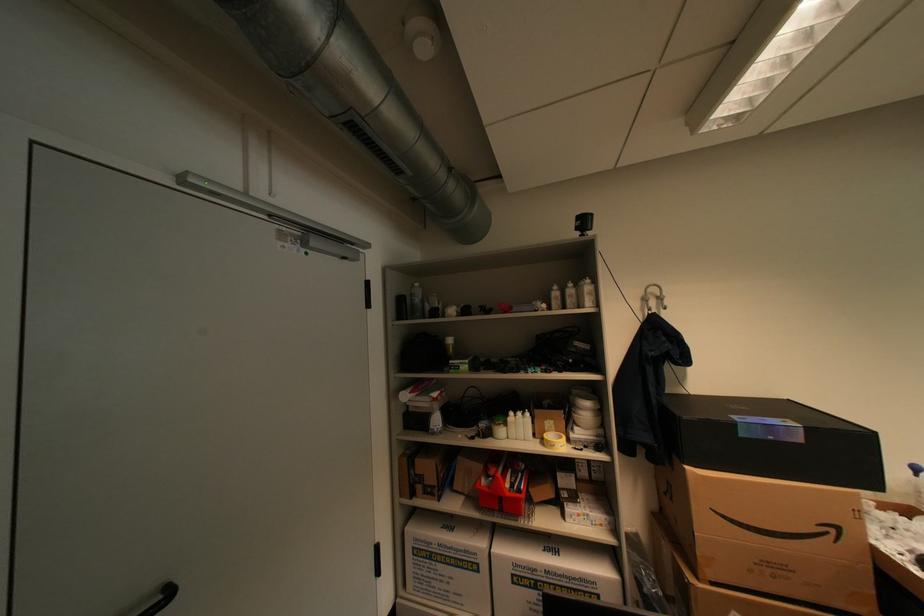
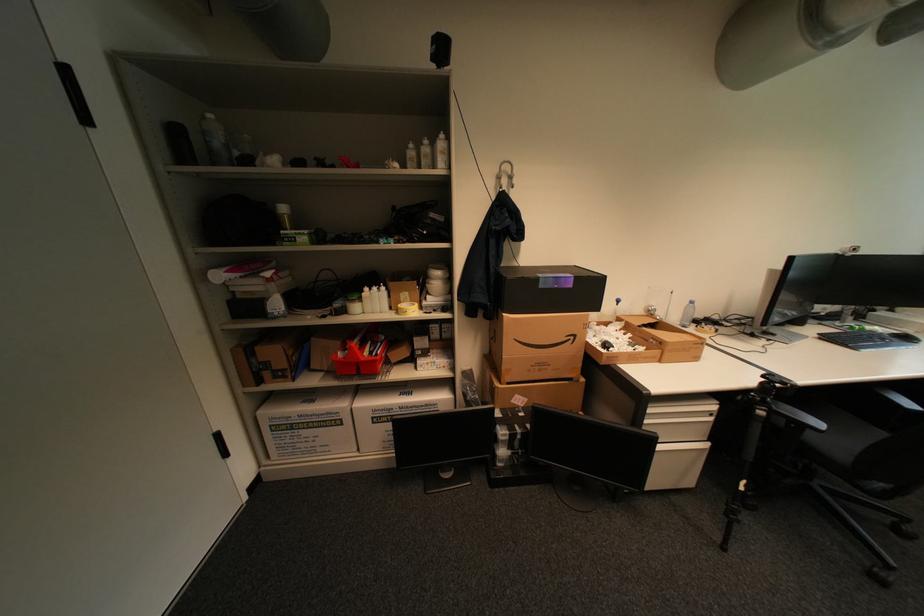
Based on the photo, the first image is from the beginning of the video and the second image is from the end. How did the camera likely rotate when shooting the video?

The camera rotated toward right-down.